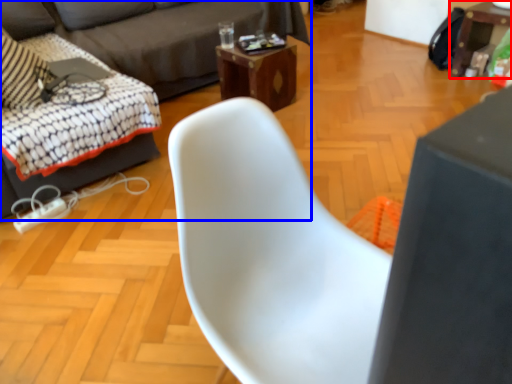
Question: Which of the following is the closest to the observer, table (highlighted by a red box) or studio couch (highlighted by a blue box)?

Choices:
 (A) table
 (B) studio couch

Answer: (B)